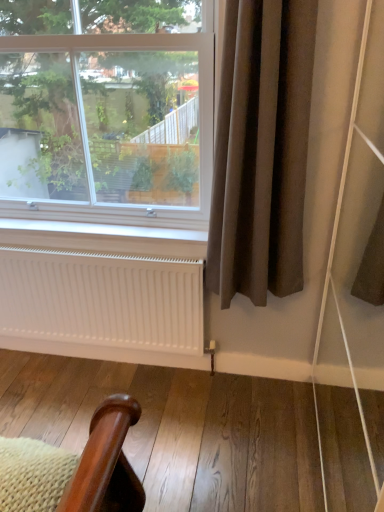
Where is `brown fabric curtain at right`? The height and width of the screenshot is (512, 384). brown fabric curtain at right is located at coordinates (261, 150).

Where is `clear glass window at upper left`? The image size is (384, 512). clear glass window at upper left is located at coordinates [x=109, y=118].

Describe the element at coordinates (102, 298) in the screenshot. This screenshot has width=384, height=512. I see `white matte radiator at lower center` at that location.

You are a GUI agent. You are given a task and a screenshot of the screen. Output one action in this format:
    pyautogui.click(x=<x>, y=<y>)
    Task: Click on the brown fabric curtain at right
    
    Given the screenshot: What is the action you would take?
    pyautogui.click(x=261, y=150)

From the image's perspective, between white matte radiator at lower center and clear glass window at upper left, who is located below?

white matte radiator at lower center, from the image's perspective.

Considering the relative sizes of white matte radiator at lower center and clear glass window at upper left in the image provided, is white matte radiator at lower center taller than clear glass window at upper left?

No, white matte radiator at lower center is not taller than clear glass window at upper left.

Is white matte radiator at lower center placed right next to clear glass window at upper left?

No.

Considering the positions of objects white matte radiator at lower center and clear glass window at upper left in the image provided, who is behind, white matte radiator at lower center or clear glass window at upper left?

white matte radiator at lower center.

Image resolution: width=384 pixels, height=512 pixels. What are the coordinates of `window lying above the brown fabric curtain at right (from the image's perspective)` in the screenshot? It's located at (109, 118).

Can you tell me how much clear glass window at upper left and brown fabric curtain at right differ in facing direction?

The facing directions of clear glass window at upper left and brown fabric curtain at right are 0.000318 degrees apart.

How much distance is there between clear glass window at upper left and brown fabric curtain at right?

29.21 inches.

Is clear glass window at upper left behind brown fabric curtain at right?

Yes.

From a real-world perspective, is clear glass window at upper left below white matte radiator at lower center?

No, from a real-world perspective, clear glass window at upper left is not under white matte radiator at lower center.

Can you confirm if clear glass window at upper left is taller than white matte radiator at lower center?

Yes, clear glass window at upper left is taller than white matte radiator at lower center.

Does clear glass window at upper left lie in front of white matte radiator at lower center?

Yes, it is.

Is brown fabric curtain at right not inside clear glass window at upper left?

Absolutely, brown fabric curtain at right is external to clear glass window at upper left.

Measure the distance between brown fabric curtain at right and clear glass window at upper left.

brown fabric curtain at right and clear glass window at upper left are 29.21 inches apart.

Is brown fabric curtain at right closer to the viewer compared to clear glass window at upper left?

Yes, brown fabric curtain at right is closer to the camera.

Is brown fabric curtain at right bigger or smaller than clear glass window at upper left?

Clearly, brown fabric curtain at right is smaller in size than clear glass window at upper left.

From the image's perspective, is white matte radiator at lower center located beneath brown fabric curtain at right?

Indeed, from the image's perspective, white matte radiator at lower center is shown beneath brown fabric curtain at right.

Is point (72, 293) closer to camera compared to point (294, 71)?

No, it is behind (294, 71).

Looking at their sizes, would you say white matte radiator at lower center is wider or thinner than brown fabric curtain at right?

white matte radiator at lower center is thinner than brown fabric curtain at right.

In the image, is white matte radiator at lower center positioned in front of or behind brown fabric curtain at right?

Clearly, white matte radiator at lower center is behind brown fabric curtain at right.

Where is `curtain that appears in front of the white matte radiator at lower center`? curtain that appears in front of the white matte radiator at lower center is located at coordinates point(261,150).

Is brown fabric curtain at right to the left of white matte radiator at lower center from the viewer's perspective?

No, brown fabric curtain at right is not to the left of white matte radiator at lower center.

Which of these two, brown fabric curtain at right or white matte radiator at lower center, stands shorter?

white matte radiator at lower center is shorter.

Is brown fabric curtain at right spatially inside white matte radiator at lower center, or outside of it?

brown fabric curtain at right lies outside white matte radiator at lower center.

What are the coordinates of `window in front of the white matte radiator at lower center` in the screenshot? It's located at (109, 118).

The width and height of the screenshot is (384, 512). Find the location of `curtain that appears below the clear glass window at upper left (from the image's perspective)`. curtain that appears below the clear glass window at upper left (from the image's perspective) is located at coordinates (261, 150).

From the image, which object appears to be farther from white matte radiator at lower center, brown fabric curtain at right or clear glass window at upper left?

Among the two, clear glass window at upper left is located further to white matte radiator at lower center.

From the image, which object appears to be farther from brown fabric curtain at right, white matte radiator at lower center or clear glass window at upper left?

The object further to brown fabric curtain at right is clear glass window at upper left.

Considering their positions, is clear glass window at upper left positioned closer to white matte radiator at lower center than brown fabric curtain at right?

brown fabric curtain at right is positioned closer to the anchor white matte radiator at lower center.

When comparing their distances from brown fabric curtain at right, does clear glass window at upper left or white matte radiator at lower center seem closer?

white matte radiator at lower center is closer to brown fabric curtain at right.

Estimate the real-world distances between objects in this image. Which object is closer to clear glass window at upper left, brown fabric curtain at right or white matte radiator at lower center?

white matte radiator at lower center lies closer to clear glass window at upper left than the other object.

Based on their spatial positions, is white matte radiator at lower center or brown fabric curtain at right further from clear glass window at upper left?

Based on the image, brown fabric curtain at right appears to be further to clear glass window at upper left.

Identify the location of window between white matte radiator at lower center and brown fabric curtain at right in the horizontal direction. (109, 118).